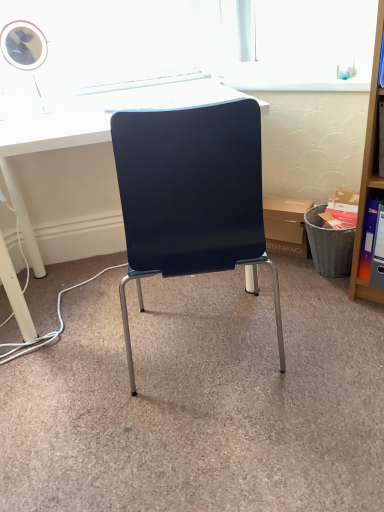
Question: Would you say white glossy desk at center is part of wooden shelf at right's contents?

Choices:
 (A) no
 (B) yes

Answer: (A)

Question: From a real-world perspective, is wooden shelf at right physically below white glossy desk at center?

Choices:
 (A) no
 (B) yes

Answer: (A)

Question: Is wooden shelf at right next to white glossy desk at center?

Choices:
 (A) no
 (B) yes

Answer: (A)

Question: Does wooden shelf at right have a larger size compared to white glossy desk at center?

Choices:
 (A) yes
 (B) no

Answer: (B)

Question: Is wooden shelf at right oriented away from white glossy desk at center?

Choices:
 (A) no
 (B) yes

Answer: (A)

Question: Could you tell me if wooden shelf at right is turned towards white glossy desk at center?

Choices:
 (A) yes
 (B) no

Answer: (B)

Question: Could wooden shelf at right be considered to be inside orange plastic ring binder at right?

Choices:
 (A) no
 (B) yes

Answer: (A)

Question: Considering the relative sizes of orange plastic ring binder at right and wooden shelf at right in the image provided, is orange plastic ring binder at right smaller than wooden shelf at right?

Choices:
 (A) no
 (B) yes

Answer: (B)

Question: Is orange plastic ring binder at right facing away from wooden shelf at right?

Choices:
 (A) no
 (B) yes

Answer: (B)

Question: From a real-world perspective, does orange plastic ring binder at right sit lower than wooden shelf at right?

Choices:
 (A) yes
 (B) no

Answer: (A)

Question: Does orange plastic ring binder at right lie behind wooden shelf at right?

Choices:
 (A) yes
 (B) no

Answer: (A)

Question: Does orange plastic ring binder at right appear on the right side of wooden shelf at right?

Choices:
 (A) no
 (B) yes

Answer: (A)

Question: From the image's perspective, is matte cardboard box at center above white glossy desk at center?

Choices:
 (A) yes
 (B) no

Answer: (B)